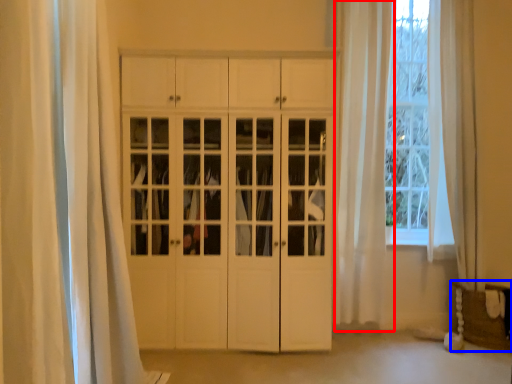
Question: Which object appears farthest to the camera in this image, curtain (highlighted by a red box) or furniture (highlighted by a blue box)?

Choices:
 (A) curtain
 (B) furniture

Answer: (A)